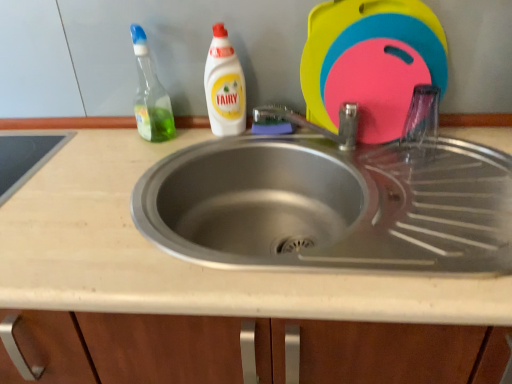
The image size is (512, 384). In order to click on vacant point above beige laminate countertop at center (from a real-world perspective) in this screenshot , I will do `click(219, 144)`.